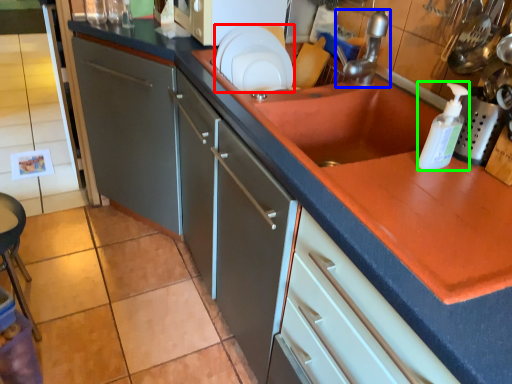
Question: Which object is the farthest from plate (highlighted by a red box)? Choose among these: tap (highlighted by a blue box) or bottle (highlighted by a green box).

Choices:
 (A) tap
 (B) bottle

Answer: (B)